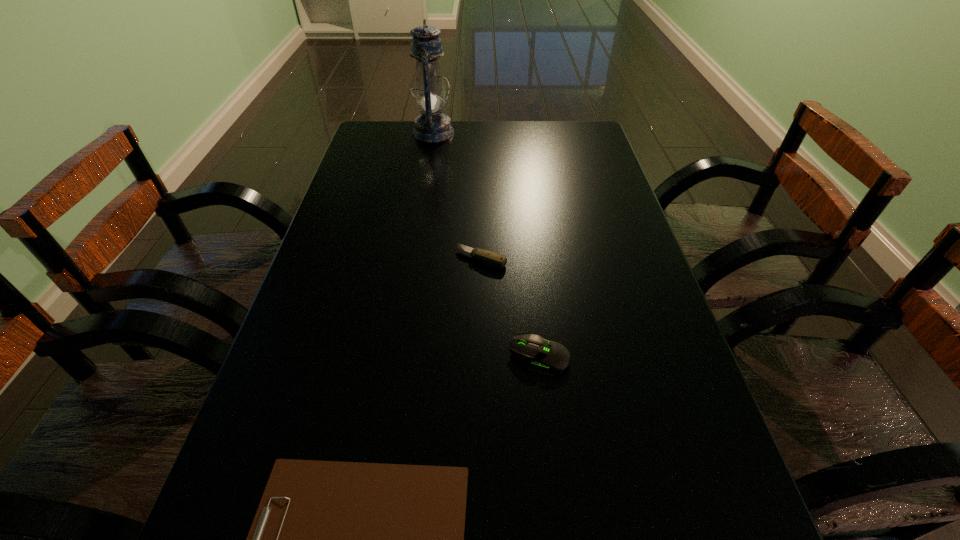
Where is `object situated at the far left corner`? object situated at the far left corner is located at coordinates (432, 126).

In the image, there is a desktop. Find the location of `vacant region at the far edge`. vacant region at the far edge is located at coordinates (506, 143).

Where is `vacant space at the left edge`? Image resolution: width=960 pixels, height=540 pixels. vacant space at the left edge is located at coordinates (325, 430).

Image resolution: width=960 pixels, height=540 pixels. I want to click on free spot at the right edge of the desktop, so click(651, 274).

Image resolution: width=960 pixels, height=540 pixels. I want to click on free space at the far left corner of the desktop, so click(x=398, y=124).

Locate an element on the screen. This screenshot has width=960, height=540. vacant space at the far right corner of the desktop is located at coordinates (x=598, y=141).

Locate an element on the screen. vacant space that's between the pocketknife and the third farthest object is located at coordinates (511, 308).

Locate an element on the screen. Image resolution: width=960 pixels, height=540 pixels. vacant space that's between the third tallest object and the third farthest object is located at coordinates (511, 308).

The image size is (960, 540). What are the coordinates of `vacant region between the farthest object and the pocketknife` in the screenshot? It's located at (458, 195).

Identify the location of vacant space that's between the tallest object and the third nearest object. Image resolution: width=960 pixels, height=540 pixels. (458, 195).